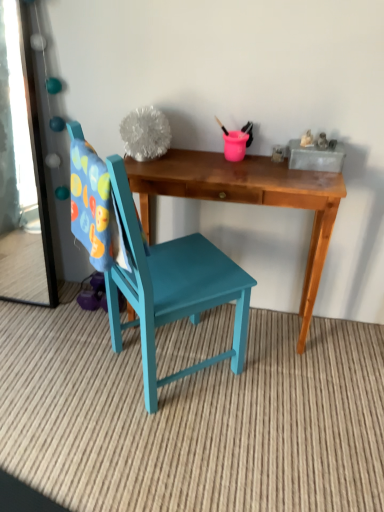
I want to click on teal painted wood chair at center, so click(x=171, y=287).

Describe the element at coordinates (171, 287) in the screenshot. I see `teal painted wood chair at center` at that location.

The width and height of the screenshot is (384, 512). What do you see at coordinates (22, 170) in the screenshot?
I see `clear glass mirror at left` at bounding box center [22, 170].

At what (x,y) coordinates should I click in order to perform the action: click on clear glass mirror at left. Please return your answer as a coordinate pair (x, y). The width and height of the screenshot is (384, 512). Looking at the image, I should click on click(22, 170).

At what (x,y) coordinates should I click in order to perform the action: click on teal painted wood chair at center. Please return your answer as a coordinate pair (x, y). This screenshot has width=384, height=512. Looking at the image, I should click on (171, 287).

Is clear glass mirror at left in front of or behind wooden desk at center in the image?

clear glass mirror at left is behind wooden desk at center.

Can you confirm if clear glass mirror at left is taller than wooden desk at center?

Indeed, clear glass mirror at left has a greater height compared to wooden desk at center.

Does clear glass mirror at left appear on the right side of wooden desk at center?

In fact, clear glass mirror at left is to the left of wooden desk at center.

From a real-world perspective, is wooden desk at center over teal painted wood chair at center?

No.

Could you tell me if wooden desk at center is facing teal painted wood chair at center?

Yes, wooden desk at center is turned towards teal painted wood chair at center.

Which of these two, wooden desk at center or teal painted wood chair at center, is bigger?

Bigger between the two is teal painted wood chair at center.

Can you tell me how much wooden desk at center and clear glass mirror at left differ in facing direction?

The facing directions of wooden desk at center and clear glass mirror at left are 0.658 degrees apart.

Is wooden desk at center facing away from clear glass mirror at left?

wooden desk at center does not have its back to clear glass mirror at left.

From a real-world perspective, between wooden desk at center and clear glass mirror at left, who is vertically higher?

clear glass mirror at left is physically above.

From the image's perspective, which one is positioned lower, wooden desk at center or clear glass mirror at left?

wooden desk at center appears lower in the image.

Between teal painted wood chair at center and clear glass mirror at left, which one has more height?

With more height is teal painted wood chair at center.

The image size is (384, 512). In order to click on mirror on the left of teal painted wood chair at center in this screenshot , I will do `click(22, 170)`.

Could you tell me if teal painted wood chair at center is facing clear glass mirror at left?

No, teal painted wood chair at center is not turned towards clear glass mirror at left.

Relative to clear glass mirror at left, is teal painted wood chair at center in front or behind?

Visually, teal painted wood chair at center is located in front of clear glass mirror at left.

Measure the distance from clear glass mirror at left to teal painted wood chair at center.

clear glass mirror at left is 98.01 centimeters away from teal painted wood chair at center.

From a real-world perspective, relative to teal painted wood chair at center, is clear glass mirror at left vertically above or below?

From a real-world perspective, clear glass mirror at left is physically above teal painted wood chair at center.

Can you confirm if clear glass mirror at left is taller than teal painted wood chair at center?

No, clear glass mirror at left is not taller than teal painted wood chair at center.

Would you consider clear glass mirror at left to be distant from teal painted wood chair at center?

That's not correct — clear glass mirror at left is a little close to teal painted wood chair at center.

At what (x,y) coordinates should I click in order to perform the action: click on chair on the left of wooden desk at center. Please return your answer as a coordinate pair (x, y). The image size is (384, 512). Looking at the image, I should click on (171, 287).

Is point (167, 263) closer to camera compared to point (309, 267)?

Yes, it is.

Would you consider teal painted wood chair at center to be distant from wooden desk at center?

No, teal painted wood chair at center is not far from wooden desk at center.

Which object is positioned more to the right, teal painted wood chair at center or wooden desk at center?

Positioned to the right is wooden desk at center.

Locate an element on the screen. Image resolution: width=384 pixels, height=512 pixels. desk located below the clear glass mirror at left (from the image's perspective) is located at coordinates [247, 198].

Find the location of `chair above the wooden desk at center (from a real-world perspective)`. chair above the wooden desk at center (from a real-world perspective) is located at coordinates (171, 287).

Estimate the real-world distances between objects in this image. Which object is further from teal painted wood chair at center, wooden desk at center or clear glass mirror at left?

The object further to teal painted wood chair at center is clear glass mirror at left.

Which object lies nearer to the anchor point wooden desk at center, clear glass mirror at left or teal painted wood chair at center?

The object closer to wooden desk at center is teal painted wood chair at center.

Estimate the real-world distances between objects in this image. Which object is further from teal painted wood chair at center, clear glass mirror at left or wooden desk at center?

clear glass mirror at left.

When comparing their distances from clear glass mirror at left, does teal painted wood chair at center or wooden desk at center seem closer?

Based on the image, teal painted wood chair at center appears to be nearer to clear glass mirror at left.

Considering their positions, is teal painted wood chair at center positioned closer to wooden desk at center than clear glass mirror at left?

Based on the image, teal painted wood chair at center appears to be nearer to wooden desk at center.

Looking at the image, which one is located further to clear glass mirror at left, wooden desk at center or teal painted wood chair at center?

wooden desk at center.

Identify the location of chair situated between clear glass mirror at left and wooden desk at center from left to right. This screenshot has width=384, height=512. (171, 287).